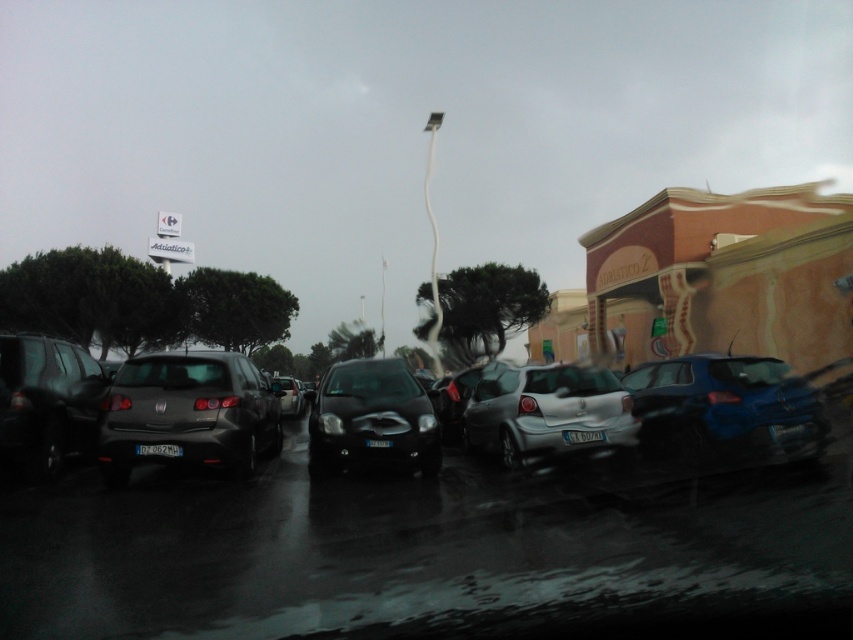
Question: Which of the following is the closest to the observer?

Choices:
 (A) shiny blue sedan at center
 (B) glossy metallic car at center

Answer: (B)

Question: Can you confirm if matte black hatchback at center is bigger than shiny blue sedan at center?

Choices:
 (A) yes
 (B) no

Answer: (A)

Question: Which point is closer to the camera?

Choices:
 (A) glossy metallic car at center
 (B) satin black car at center
 (C) shiny blue sedan at center

Answer: (A)

Question: Is glossy metallic car at center closer to camera compared to shiny black sedan at left?

Choices:
 (A) no
 (B) yes

Answer: (B)

Question: Which point appears closest to the camera in this image?

Choices:
 (A) coord(300,406)
 (B) coord(310,417)

Answer: (B)

Question: Does shiny blue sedan at center have a lesser width compared to satin black car at center?

Choices:
 (A) yes
 (B) no

Answer: (A)